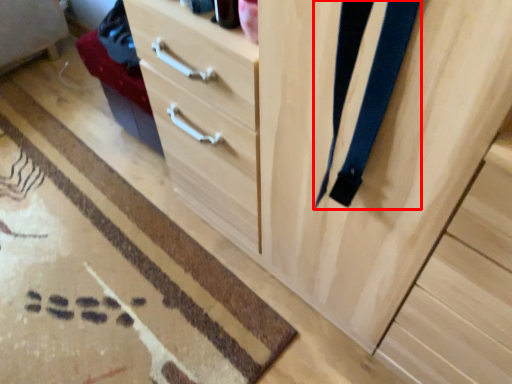
Question: From the image's perspective, where is suspenders (annotated by the red box) located relative to doormat?

Choices:
 (A) above
 (B) below

Answer: (A)